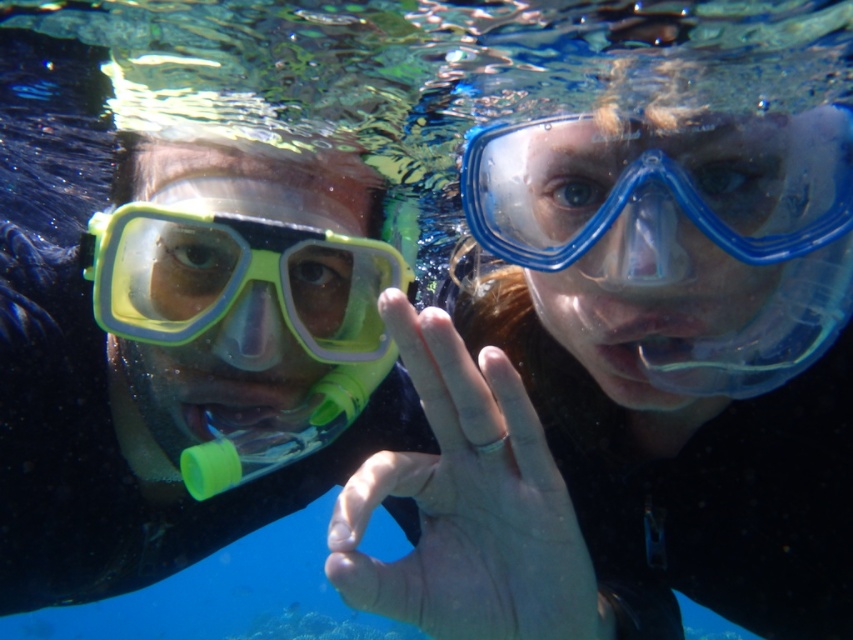
You are a photographer trying to capture the transparent blue goggles at upper right and the matte green snorkel mask at left in focus simultaneously. Based on their positions, do you think you can achieve this with your current camera settings?

The transparent blue goggles at upper right is behind the matte green snorkel mask at left, so it might be challenging to focus both in the same shot since they are at different depths.